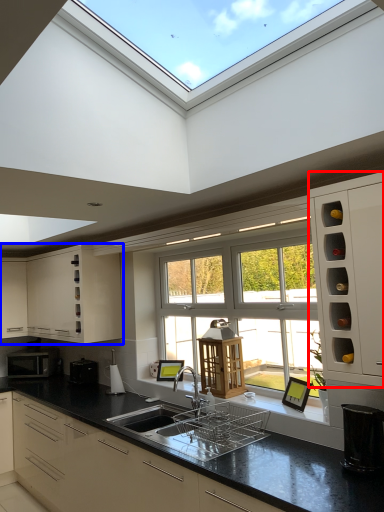
Question: Which object is closer to the camera taking this photo, cabinetry (highlighted by a red box) or cabinetry (highlighted by a blue box)?

Choices:
 (A) cabinetry
 (B) cabinetry

Answer: (A)